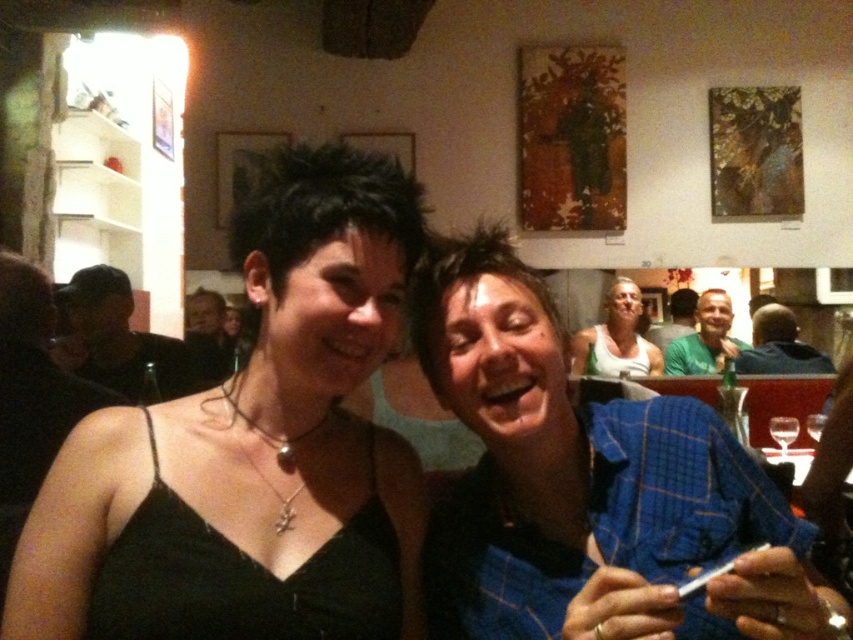
Question: Estimate the real-world distances between objects in this image. Which object is farther from the green shirt at center?

Choices:
 (A) white tank top at center
 (B) matte blue shirt at center

Answer: (A)

Question: Estimate the real-world distances between objects in this image. Which object is farther from the green shirt at center?

Choices:
 (A) blue plaid shirt at right
 (B) matte black shirt at center
 (C) blue plaid shirt at center
 (D) dark brown leather jacket at left

Answer: (C)

Question: Can you confirm if blue plaid shirt at center is positioned below matte black shirt at center?

Choices:
 (A) yes
 (B) no

Answer: (A)

Question: Is dark brown leather jacket at left closer to the viewer compared to matte blue shirt at center?

Choices:
 (A) yes
 (B) no

Answer: (A)

Question: Which point appears farthest from the camera in this image?

Choices:
 (A) (114, 305)
 (B) (514, 621)

Answer: (A)

Question: Is matte black shirt at center bigger than transparent glass at center?

Choices:
 (A) yes
 (B) no

Answer: (B)